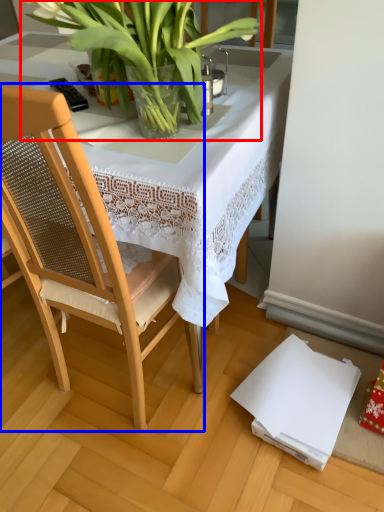
Question: Which point is closer to the camera, houseplant (highlighted by a red box) or chair (highlighted by a blue box)?

Choices:
 (A) houseplant
 (B) chair

Answer: (B)